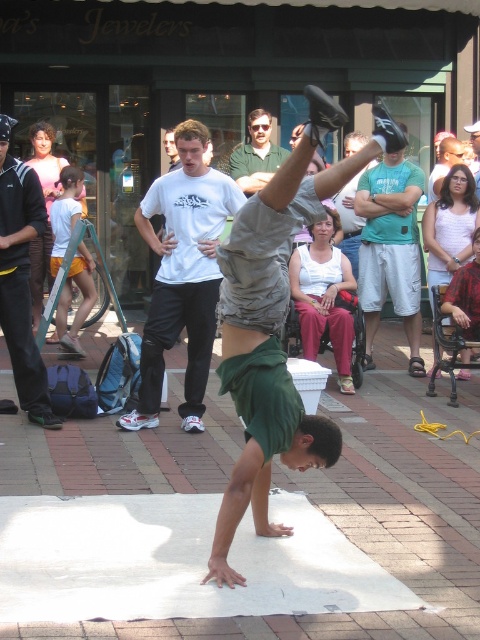
You are a photographer trying to capture the perfect shot of the breakdancer. You notice the matte black hair at upper left in the scene. Where exactly should you position your camera to ensure this hair is in the frame?

The matte black hair at upper left is located at coordinates point (46, 209), so position your camera to include this point in the frame.

You are a photographer trying to capture the breakdancer in the center of the image. You notice two shirts in the scene, the green cotton shirt at center and the white cotton shirt at center. Which shirt should you focus on to ensure the breakdancer is in the foreground of your photo?

The green cotton shirt at center is above the white cotton shirt at center, so focusing on the green cotton shirt at center will ensure the breakdancer is in the foreground since it is positioned higher in the image.

You are a photographer trying to capture a photo of the breakdancer. You notice two shirts at the center of the scene. Which shirt should you focus on if you want to include the white cotton shirt at center in your shot without any obstruction from the green cotton shirt at center?

You should focus on the white cotton shirt at center because the green cotton shirt at center is positioned on its right side, so aiming at the white one will ensure the green shirt doesn not block it.